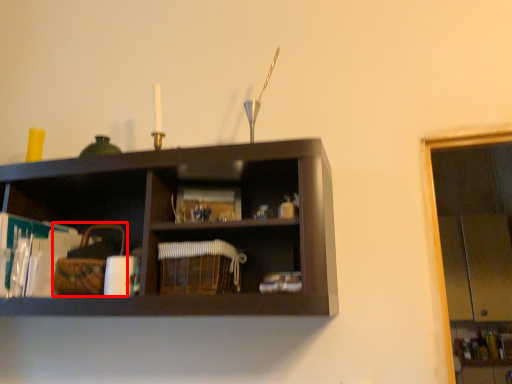
Question: Observing the image, what is the correct spatial positioning of basket (annotated by the red box) in reference to basket?

Choices:
 (A) right
 (B) left

Answer: (B)